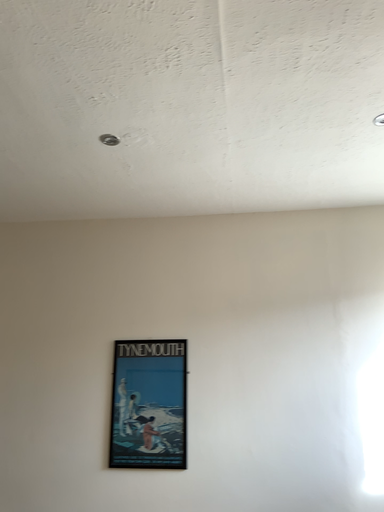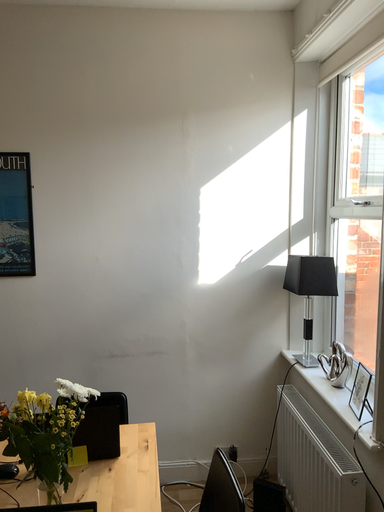
Question: How did the camera likely rotate when shooting the video?

Choices:
 (A) rotated left
 (B) rotated right

Answer: (B)